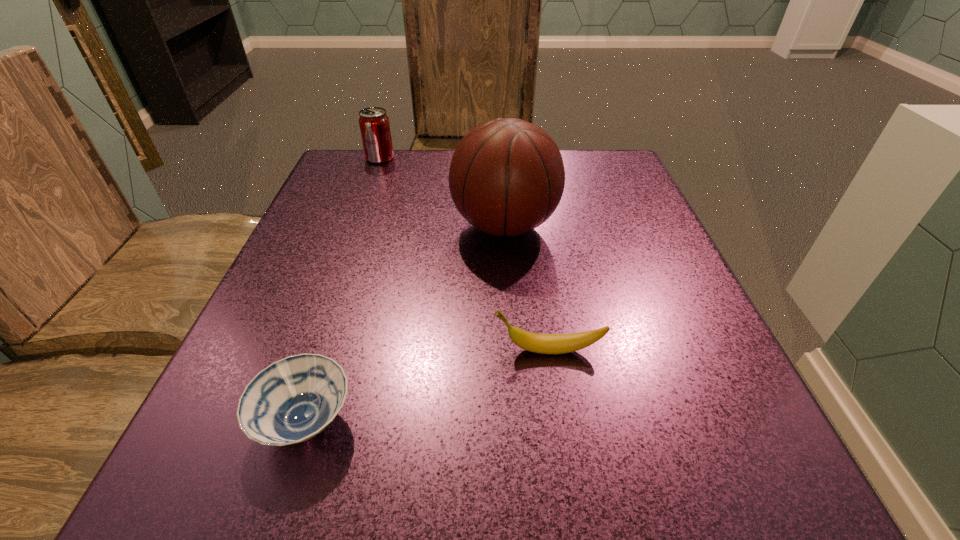
In order to click on vacant space that is in between the second farthest object and the soup bowl in this screenshot , I will do `click(405, 323)`.

Locate an element on the screen. empty space that is in between the shortest object and the tallest object is located at coordinates (405, 323).

This screenshot has width=960, height=540. I want to click on free space between the third nearest object and the second nearest object, so [526, 288].

At what (x,y) coordinates should I click in order to perform the action: click on unoccupied area between the third farthest object and the basketball. Please return your answer as a coordinate pair (x, y). This screenshot has width=960, height=540. Looking at the image, I should click on (526, 288).

Locate an element on the screen. This screenshot has width=960, height=540. free spot between the third shortest object and the third farthest object is located at coordinates (464, 254).

I want to click on unoccupied area between the third shortest object and the tallest object, so click(443, 192).

Where is `object identified as the third closest to the second tallest object`? Image resolution: width=960 pixels, height=540 pixels. object identified as the third closest to the second tallest object is located at coordinates (292, 400).

The height and width of the screenshot is (540, 960). I want to click on object that stands as the closest to the second tallest object, so click(x=506, y=177).

Locate an element on the screen. The image size is (960, 540). vacant space that satisfies the following two spatial constraints: 1. at the stem of the third farthest object; 2. on the front side of the soup bowl is located at coordinates (559, 421).